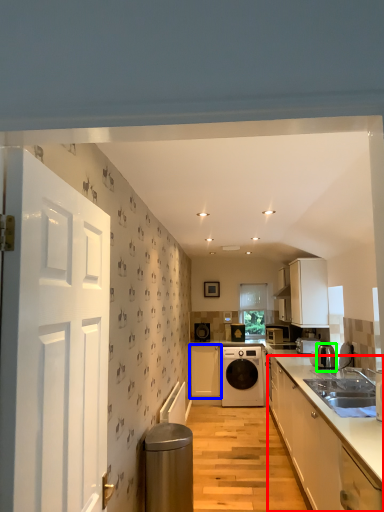
Question: Which object is the closest to the cabinetry (highlighted by a red box)? Choose among these: cabinetry (highlighted by a blue box) or kitchen appliance (highlighted by a green box).

Choices:
 (A) cabinetry
 (B) kitchen appliance

Answer: (B)